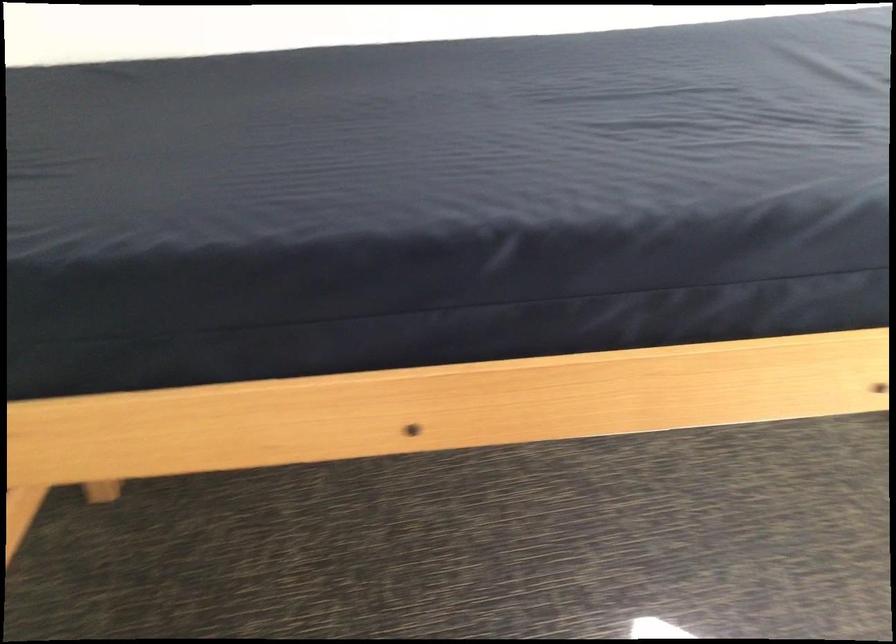
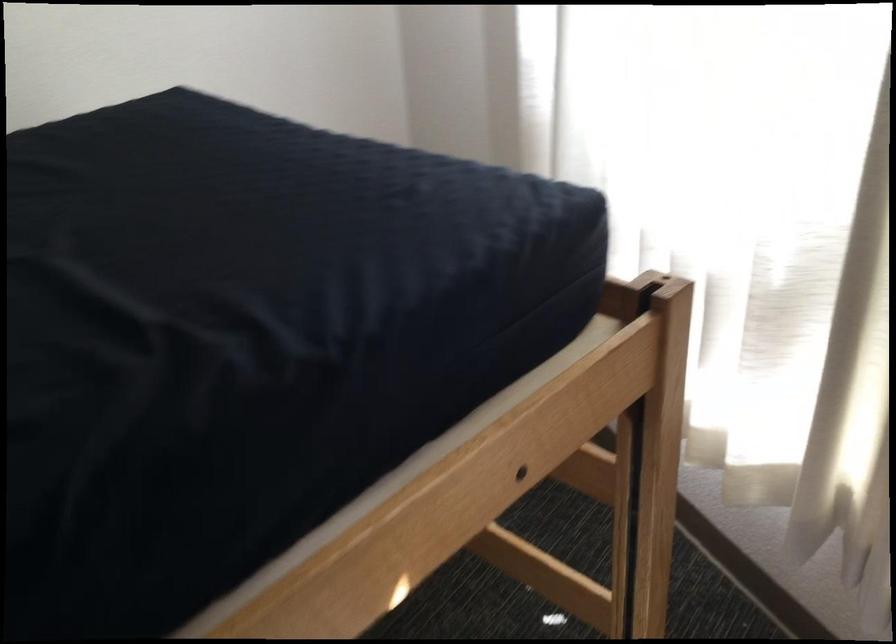
Question: How did the camera likely rotate?

Choices:
 (A) Left
 (B) Right
 (C) Up
 (D) Down

Answer: (B)